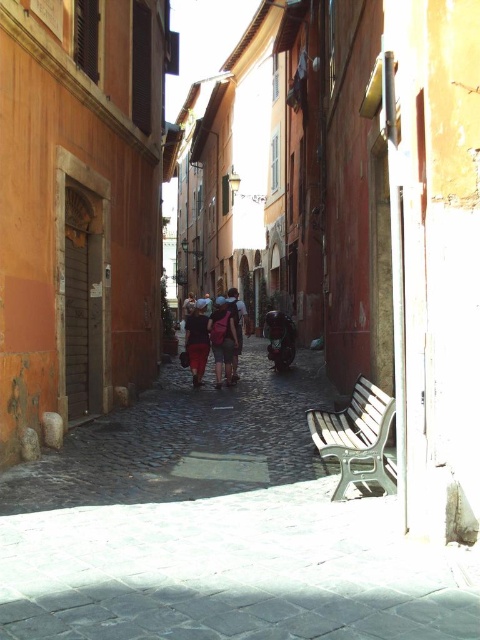
You are a tourist carrying a large backpack and want to place your bag on the bench. However, you also see a dark blue fabric in the center of the street. How far apart are the white plastic bench at lower right and the dark blue fabric at center?

The white plastic bench at lower right and dark blue fabric at center are 22.30 feet apart from each other.

You are a photographer standing at the camera position in the scene. You want to place a 1.5 meter wide tripod between yourself and the white plastic bench at lower right. Is there enough space to set it up without moving the bench?

The distance between the camera and the white plastic bench at lower right is 4.08 meters. Since the tripod is only 1.5 meters wide, there is sufficient space to place it between the two without needing to move the bench.

You are a parent pushing a green fabric baby carriage at center along the cobblestone street. You want to sit down on the white plastic bench at lower right to rest. Is the bench between you and the building behind the bench?

Yes, the white plastic bench at lower right is in front of the green fabric baby carriage at center, meaning the bench is between you and the building behind it.